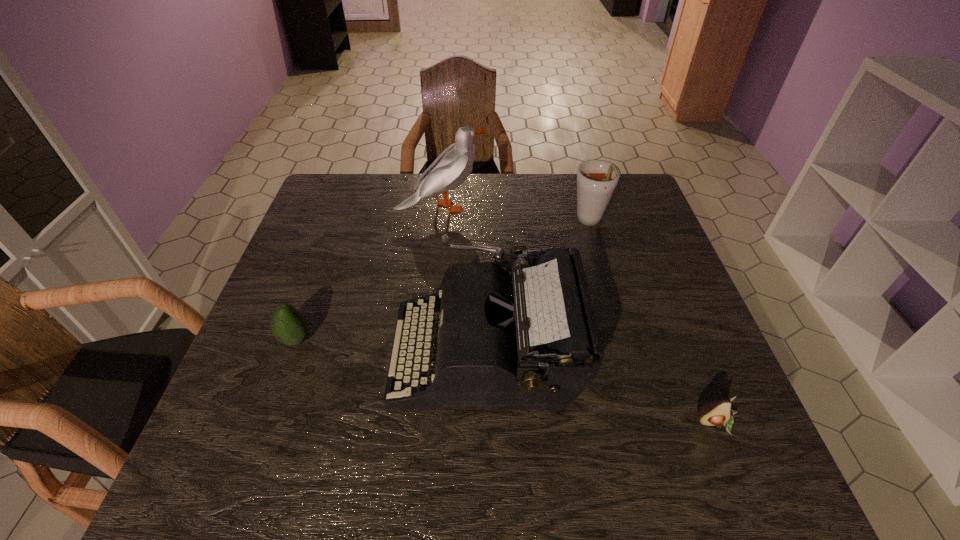
The image size is (960, 540). I want to click on vacant position at the near edge of the desktop, so click(x=571, y=488).

Where is `vacant space at the right edge`? This screenshot has height=540, width=960. vacant space at the right edge is located at coordinates (645, 288).

The height and width of the screenshot is (540, 960). What are the coordinates of `free region at the far left corner of the desktop` in the screenshot? It's located at (356, 178).

You are a GUI agent. You are given a task and a screenshot of the screen. Output one action in this format:
    pyautogui.click(x=<x>, y=<y>)
    Task: Click on the blank space at the far right corner of the desktop
    The image size is (960, 540).
    Given the screenshot: What is the action you would take?
    pyautogui.click(x=620, y=190)

Identify the location of free space between the leftmost object and the typewriter. (391, 346).

Find the location of `free space between the right avocado and the second object from right to left`. free space between the right avocado and the second object from right to left is located at coordinates (653, 322).

Find the location of a particular element. The image size is (960, 540). empty space between the typewriter and the nearer avocado is located at coordinates (601, 388).

Locate an element on the screen. This screenshot has height=540, width=960. vacant point located between the farther avocado and the gull is located at coordinates (369, 274).

I want to click on vacant space that is in between the right avocado and the typewriter, so click(x=601, y=388).

Select which object appears as the closest to the fourth object from left to right. Please provide its 2D coordinates. Your answer should be formatted as a tuple, i.e. [(x, y)], where the tuple contains the x and y coordinates of a point satisfying the conditions above.

[(527, 341)]